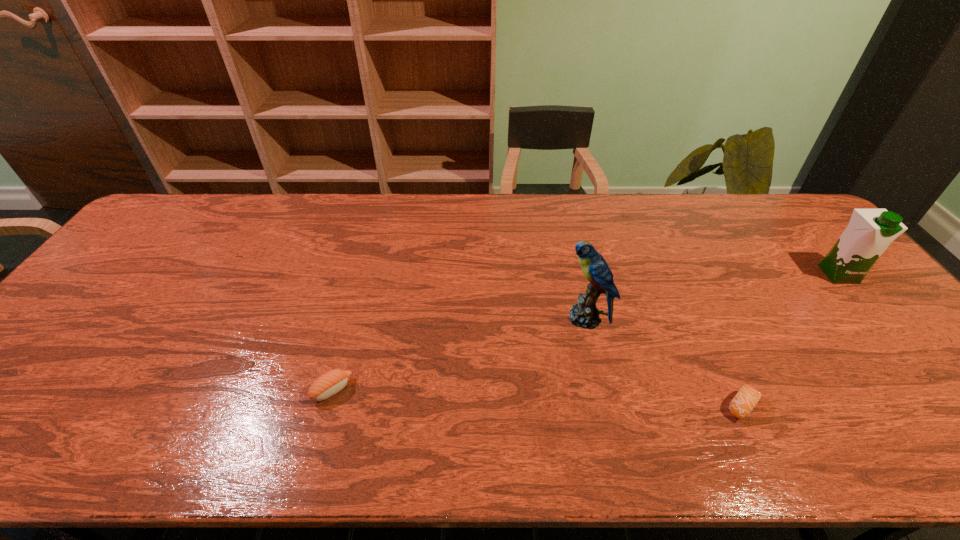
Identify the location of vacant space located on the face of the parrot. (427, 318).

Identify the location of vacant point located 0.120m on the front-facing side of the soya milk. This screenshot has width=960, height=540. (876, 319).

Find the location of `free location located on the front of the third tallest object`. free location located on the front of the third tallest object is located at coordinates (313, 458).

You are a GUI agent. You are given a task and a screenshot of the screen. Output one action in this format:
    pyautogui.click(x=<x>, y=<y>)
    Task: Click on the vacant region located 0.290m on the right of the shorter sushi
    Image resolution: width=960 pixels, height=540 pixels.
    Given the screenshot: What is the action you would take?
    pyautogui.click(x=892, y=406)

This screenshot has width=960, height=540. I want to click on object positioned at the near edge, so click(747, 397).

Find the location of a particular element. object that is at the right edge is located at coordinates (869, 233).

Where is `vacant space at the far edge of the desktop`? vacant space at the far edge of the desktop is located at coordinates (684, 229).

This screenshot has width=960, height=540. In order to click on vacant region at the right edge of the desktop in this screenshot , I will do `click(882, 342)`.

You are a GUI agent. You are given a task and a screenshot of the screen. Output one action in this format:
    pyautogui.click(x=<x>, y=<y>)
    Task: Click on the vacant region at the far left corner of the desktop
    
    Given the screenshot: What is the action you would take?
    point(198,202)

Identify the location of free space between the left sushi and the right sushi. The height and width of the screenshot is (540, 960). (538, 398).